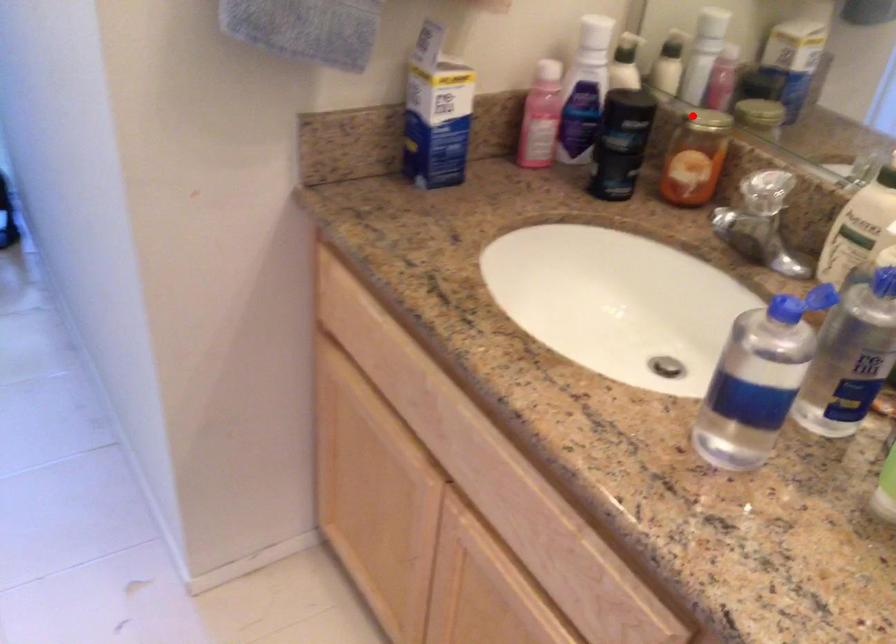
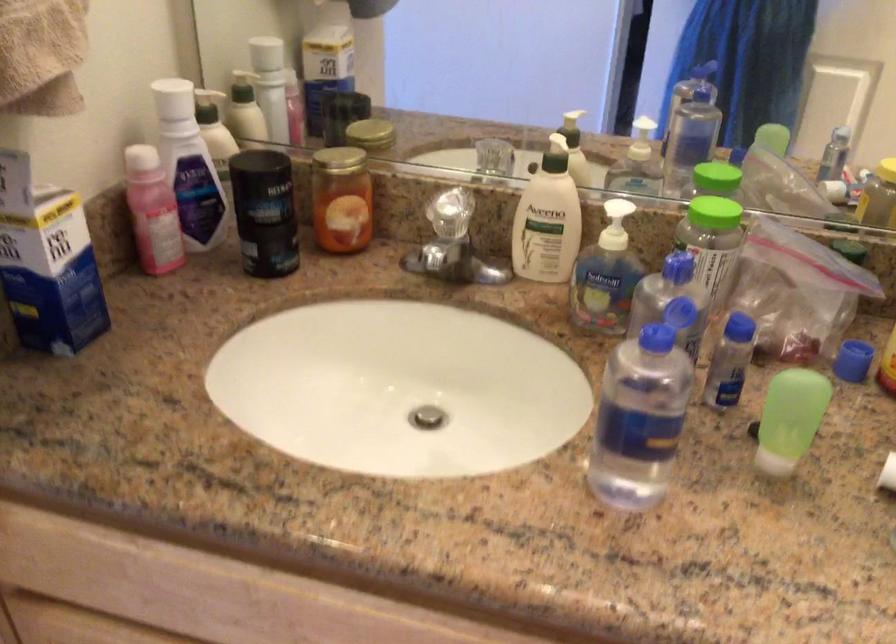
Question: A red point is marked in image1. In image2, is the corresponding 3D point closer to the camera or farther? Reply with the corresponding letter.

Choices:
 (A) The corresponding 3D point is closer.
 (B) The corresponding 3D point is farther.

Answer: (A)